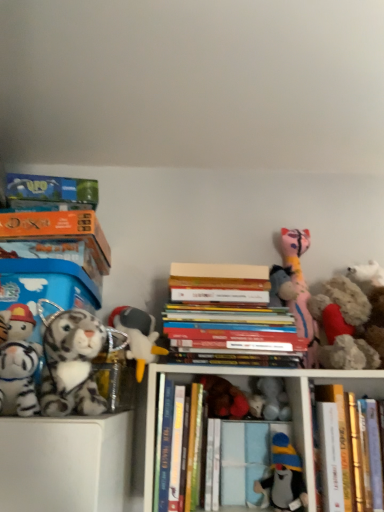
Question: Considering the relative sizes of white plush toy at center, the 5th toy in the left-to-right sequence, and fluffy beige stuffed animal at right, the eighth toy when ordered from left to right, in the image provided, is white plush toy at center, the 5th toy in the left-to-right sequence, smaller than fluffy beige stuffed animal at right, the eighth toy when ordered from left to right,?

Choices:
 (A) yes
 (B) no

Answer: (A)

Question: Is white plush toy at center, marked as the fifth toy in a right-to-left arrangement, shorter than fluffy beige stuffed animal at right, acting as the 2th toy starting from the right?

Choices:
 (A) yes
 (B) no

Answer: (A)

Question: Does white plush toy at center, marked as the fifth toy in a right-to-left arrangement, lie in front of fluffy beige stuffed animal at right, the eighth toy when ordered from left to right?

Choices:
 (A) yes
 (B) no

Answer: (B)

Question: From the image's perspective, would you say white plush toy at center, marked as the fifth toy in a right-to-left arrangement, is positioned over fluffy beige stuffed animal at right, acting as the 2th toy starting from the right?

Choices:
 (A) no
 (B) yes

Answer: (A)

Question: Considering the relative positions of white plush toy at center, marked as the fifth toy in a right-to-left arrangement, and fluffy beige stuffed animal at right, the eighth toy when ordered from left to right, in the image provided, is white plush toy at center, marked as the fifth toy in a right-to-left arrangement, to the left of fluffy beige stuffed animal at right, the eighth toy when ordered from left to right, from the viewer's perspective?

Choices:
 (A) no
 (B) yes

Answer: (B)

Question: Is fluffy white teddy bear at right, placed as the 9th toy when sorted from left to right, wider or thinner than white plush tiger at left, which appears as the ninth toy when viewed from the right?

Choices:
 (A) wide
 (B) thin

Answer: (A)

Question: From the image's perspective, is fluffy white teddy bear at right, the 1th toy when ordered from right to left, located above or below white plush tiger at left, which appears as the ninth toy when viewed from the right?

Choices:
 (A) below
 (B) above

Answer: (B)

Question: Is fluffy white teddy bear at right, the 1th toy when ordered from right to left, taller or shorter than white plush tiger at left, the 1th toy in the left-to-right sequence?

Choices:
 (A) tall
 (B) short

Answer: (A)

Question: Relative to white plush tiger at left, which appears as the ninth toy when viewed from the right, is fluffy white teddy bear at right, the 1th toy when ordered from right to left, in front or behind?

Choices:
 (A) behind
 (B) front

Answer: (A)

Question: Looking at the image, does hardcover book at center, which is counted as the fourth book, starting from the left, seem bigger or smaller compared to white plush toy at center-left, acting as the seventh toy starting from the right?

Choices:
 (A) small
 (B) big

Answer: (A)

Question: Considering the positions of point (339, 432) and point (150, 316), is point (339, 432) closer or farther from the camera than point (150, 316)?

Choices:
 (A) farther
 (B) closer

Answer: (B)

Question: Looking at their shapes, would you say hardcover book at center, positioned as the first book in right-to-left order, is wider or thinner than white plush toy at center-left, the 3th toy when ordered from left to right?

Choices:
 (A) wide
 (B) thin

Answer: (A)

Question: From the image's perspective, is hardcover book at center, positioned as the first book in right-to-left order, positioned above or below white plush toy at center-left, acting as the seventh toy starting from the right?

Choices:
 (A) above
 (B) below

Answer: (B)

Question: In terms of width, does hardcover books at center, which appears as the third book when viewed from the left, look wider or thinner when compared to hardcover books at center?

Choices:
 (A) thin
 (B) wide

Answer: (A)

Question: Is hardcover books at center, which appears as the third book when viewed from the left, in front of or behind hardcover books at center in the image?

Choices:
 (A) front
 (B) behind

Answer: (B)